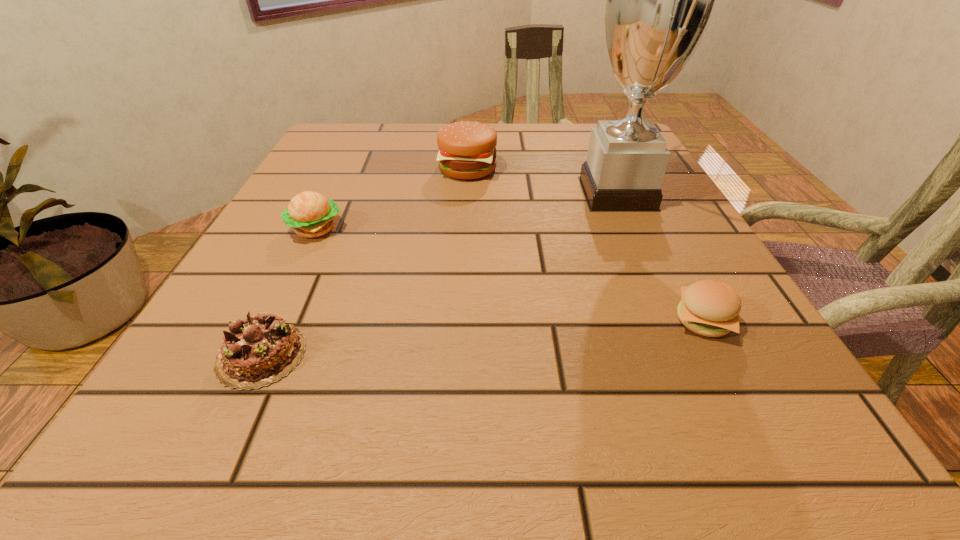
Find the location of a particular element. Image resolution: width=960 pixels, height=540 pixels. free space between the trophy cup and the rightmost hamburger is located at coordinates (660, 257).

Where is `free space that is in between the trophy cup and the farthest hamburger`? The width and height of the screenshot is (960, 540). free space that is in between the trophy cup and the farthest hamburger is located at coordinates (542, 181).

Where is `vacant area that lies between the second nearest hamburger and the trophy cup`? The image size is (960, 540). vacant area that lies between the second nearest hamburger and the trophy cup is located at coordinates (467, 211).

Locate an element on the screen. Image resolution: width=960 pixels, height=540 pixels. free space that is in between the chocolate cake and the leftmost hamburger is located at coordinates (288, 292).

The width and height of the screenshot is (960, 540). I want to click on free spot between the farthest hamburger and the leftmost hamburger, so click(x=392, y=199).

Identify which object is the third closest to the rightmost hamburger. Please provide its 2D coordinates. Your answer should be formatted as a tuple, i.e. [(x, y)], where the tuple contains the x and y coordinates of a point satisfying the conditions above.

[(257, 351)]

At what (x,y) coordinates should I click in order to perform the action: click on object that is the third closest to the second nearest hamburger. Please return your answer as a coordinate pair (x, y). Image resolution: width=960 pixels, height=540 pixels. Looking at the image, I should click on (660, 0).

Where is `the closest hamburger relative to the nearest hamburger`? This screenshot has height=540, width=960. the closest hamburger relative to the nearest hamburger is located at coordinates (467, 150).

This screenshot has width=960, height=540. Identify the location of the closest hamburger to the second nearest hamburger. (467, 150).

Identify the location of free space that satisfies the following two spatial constraints: 1. at the front view of the trophy cup; 2. on the left side of the nearest hamburger. (675, 321).